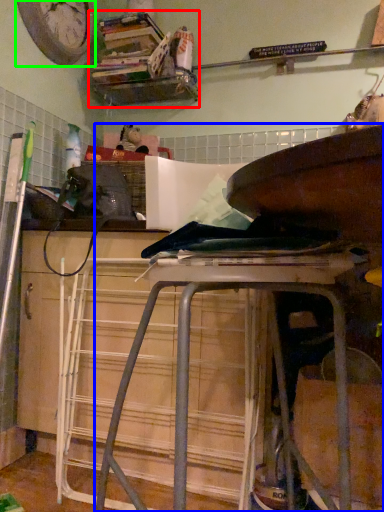
Question: Based on their relative distances, which object is farther from shelf (highlighted by a red box)? Choose from furniture (highlighted by a blue box) and clock (highlighted by a green box).

Choices:
 (A) furniture
 (B) clock

Answer: (A)